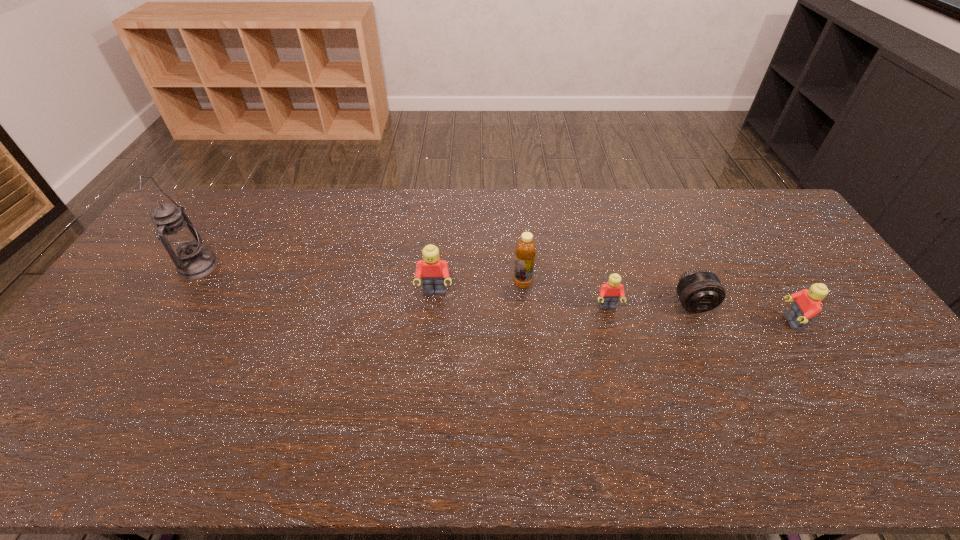
Where is `free region at the near edge`? The image size is (960, 540). free region at the near edge is located at coordinates (580, 397).

This screenshot has height=540, width=960. What are the coordinates of `free space at the left edge` in the screenshot? It's located at (120, 368).

Identify the location of vacant space at the far left corner of the desktop. This screenshot has width=960, height=540. (203, 205).

Image resolution: width=960 pixels, height=540 pixels. In the image, there is a desktop. What are the coordinates of `vacant space at the near right corner` in the screenshot? It's located at (875, 405).

You are a GUI agent. You are given a task and a screenshot of the screen. Output one action in this format:
    pyautogui.click(x=<x>, y=<y>)
    Task: Click on the free space between the second Lego from right to left and the farthest Lego
    The image size is (960, 540).
    Given the screenshot: What is the action you would take?
    pyautogui.click(x=521, y=300)

Where is `vacant region between the fifth object from left to right and the shortest Lego`? This screenshot has width=960, height=540. vacant region between the fifth object from left to right and the shortest Lego is located at coordinates (650, 305).

Identify the location of empty space between the telephoto lens and the rightmost Lego. (742, 313).

Where is `free spot between the telephoto lens and the third object from right to left`? free spot between the telephoto lens and the third object from right to left is located at coordinates (650, 305).

Identify the location of vacant space that's between the leftmost Lego and the telephoto lens. (564, 298).

The height and width of the screenshot is (540, 960). Identify the location of vacant area that lies between the second shortest Lego and the fourth object from left to right. (700, 315).